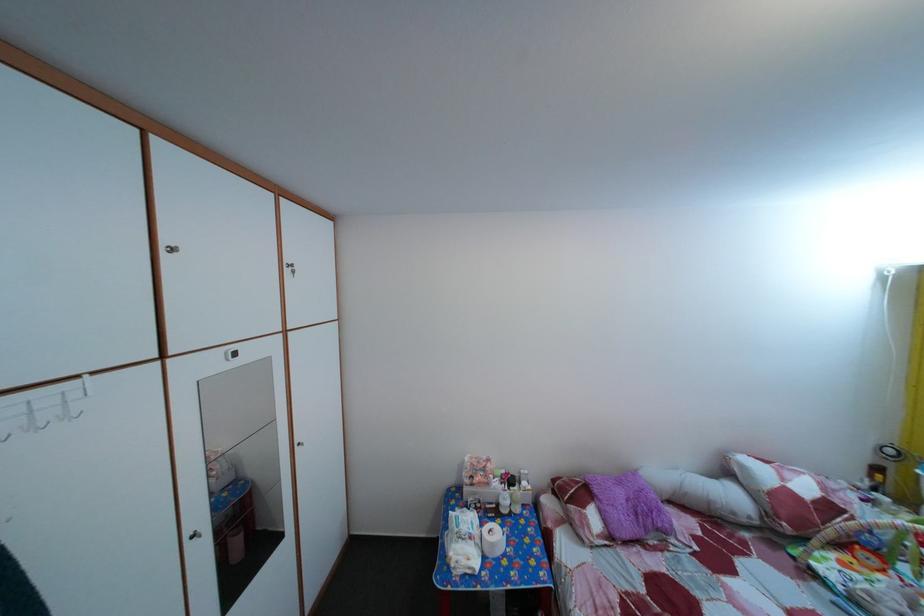
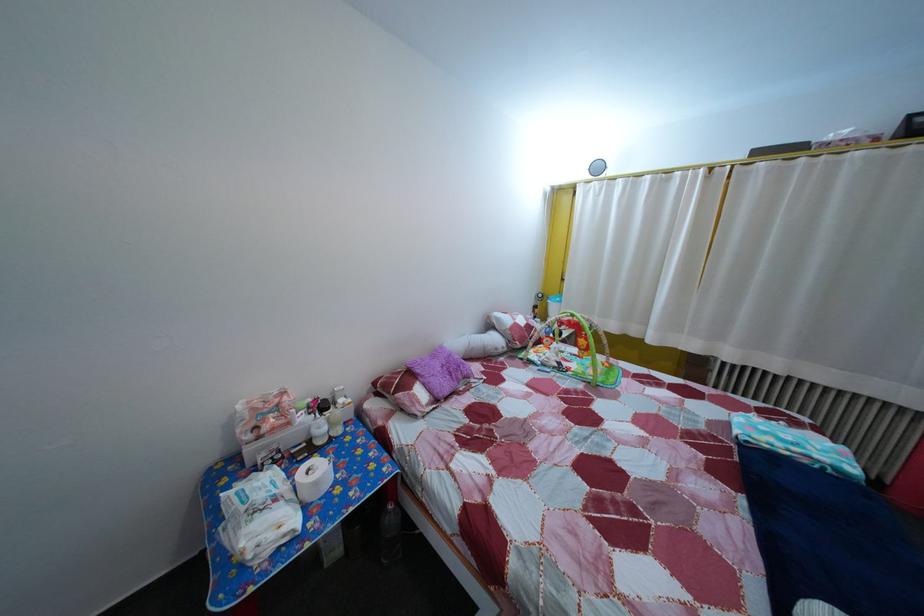
Locate, in the second image, the point that corresponds to [502,553] in the first image.

(325, 491)